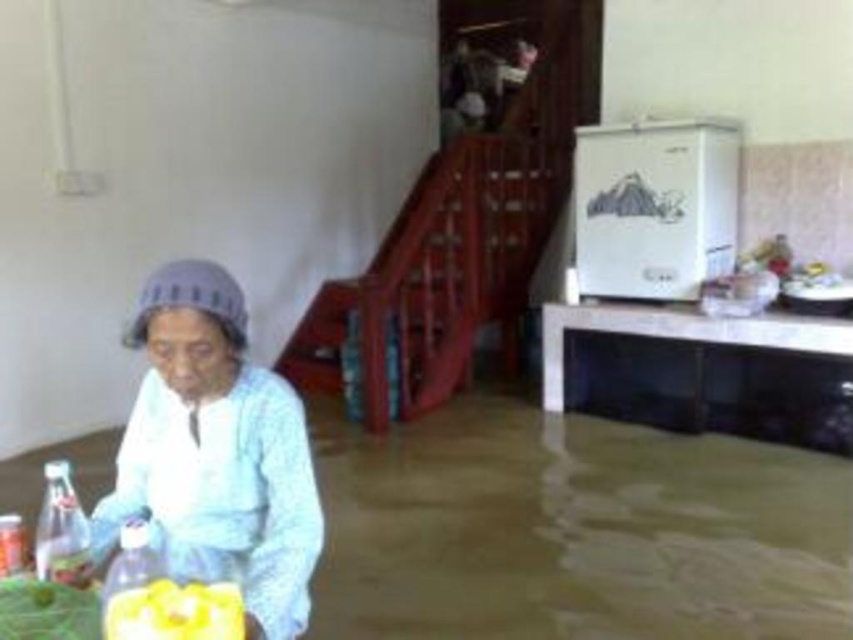
You are a delivery person entering a flooded room. You see a white cotton shirt at lower left and a yellow matte juice at lower left. Which object is taller?

The white cotton shirt at lower left is taller than the yellow matte juice at lower left according to the description.

You are a cleaning robot in the flooded living room. You need to reach the white glossy table at lower right to place a mop. However, there is a point at coordinates (x=701, y=369) in your system. Is this point on the white glossy table at lower right or somewhere else?

The point (x=701, y=369) is on the white glossy table at lower right according to the description, so the robot can safely navigate to that location to place the mop.